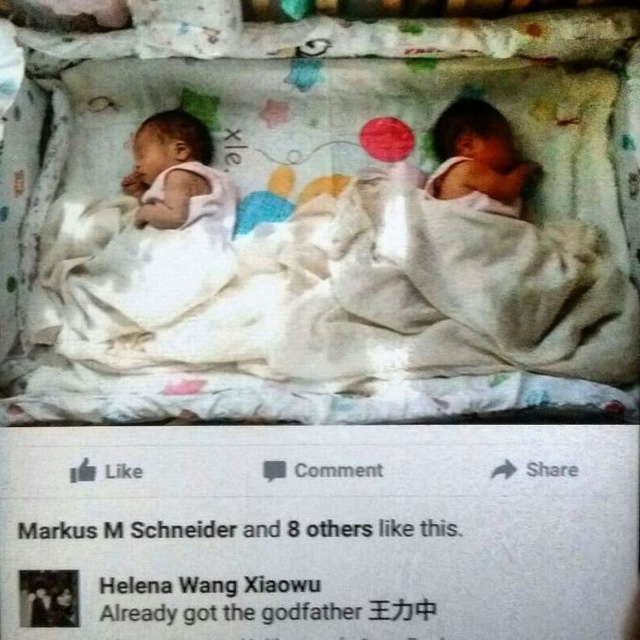
Question: Which object is farther from the camera taking this photo?

Choices:
 (A) white soft blanket at center
 (B) smooth skin newborn at right

Answer: (B)

Question: Is white soft blanket at center bigger than smooth skin newborn at right?

Choices:
 (A) no
 (B) yes

Answer: (B)

Question: Is white soft blanket at center bigger than smooth skin newborn at right?

Choices:
 (A) no
 (B) yes

Answer: (B)

Question: Can you confirm if white soft blanket at center is positioned above smooth skin newborn at right?

Choices:
 (A) no
 (B) yes

Answer: (A)